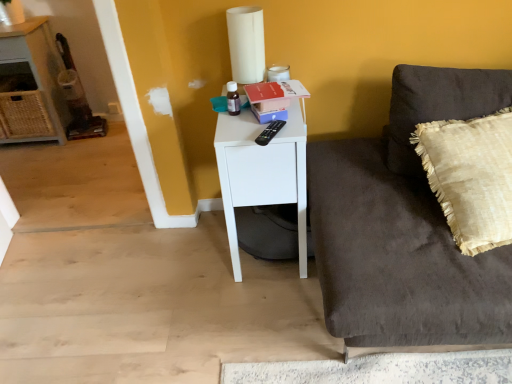
Question: Which is correct: woven wicker cabinet at left is inside dark brown velvety couch at right, or outside of it?

Choices:
 (A) inside
 (B) outside

Answer: (B)

Question: From a real-world perspective, is woven wicker cabinet at left physically located above or below dark brown velvety couch at right?

Choices:
 (A) below
 (B) above

Answer: (A)

Question: Which is farther from the dark brown velvety couch at right?

Choices:
 (A) black plastic remote control at upper right
 (B) white matte side table at center
 (C) beige textured pillow at right
 (D) woven wicker cabinet at left

Answer: (D)

Question: Considering the real-world distances, which object is closest to the dark brown velvety couch at right?

Choices:
 (A) beige textured pillow at right
 (B) woven wicker cabinet at left
 (C) white matte side table at center
 (D) black plastic remote control at upper right

Answer: (A)